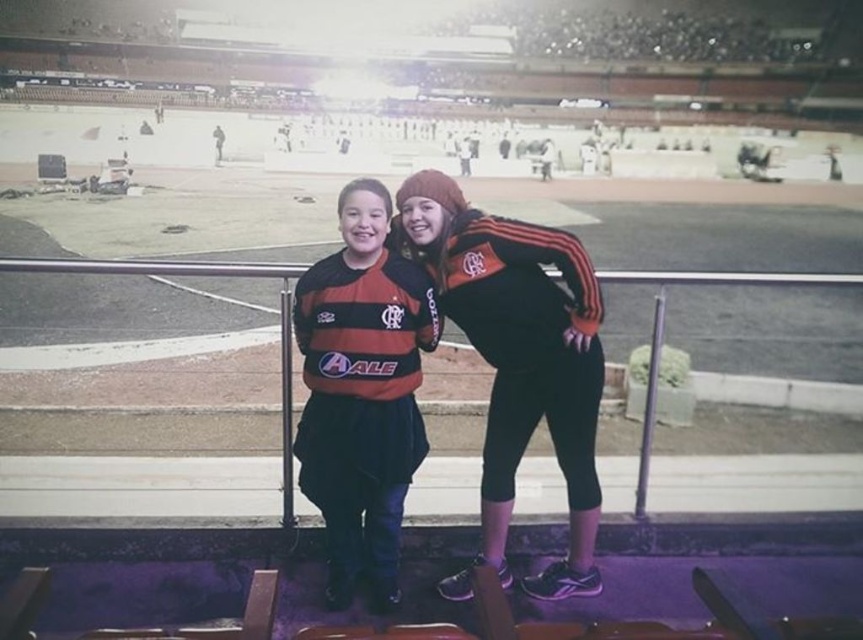
You are standing at the edge of the sports stadium stand and want to toss a small ball to someone exactly where the black matte jacket at center is located. If your throwing range is up to 2.5 meters, will you be able to reach that spot?

The black matte jacket at center and viewer are 2.61 meters apart from each other. Since your throwing range is up to 2.5 meters, you cannot reach the spot where the black matte jacket at center is located.

You are a photographer trying to capture a candid shot of both the black matte jacket at center and the matte jersey at center from your position behind them. Considering their sizes, which one do you think might block the other when framing the shot?

The black matte jacket at center has a larger width than the matte jersey at center, so it might block the jersey if positioned in front.

You are a photographer trying to capture a candid shot of both the black matte jacket at center and the matte jersey at center. Since you can only focus on one subject at a time, which one should you focus on to ensure the other is still in the background?

You should focus on the matte jersey at center because it is behind the black matte jacket at center, so keeping the matte jersey at center in focus will naturally place the black matte jacket at center in the background.